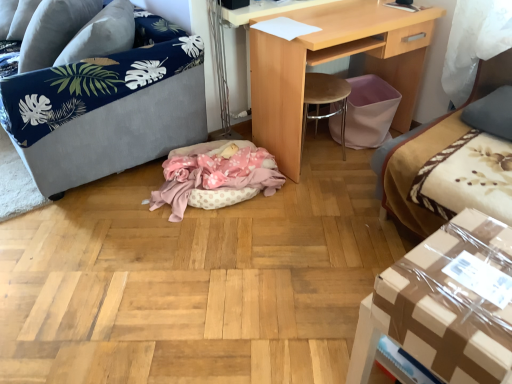
Identify the location of vacant space in front of pink polka dot fabric cat bed at center. The width and height of the screenshot is (512, 384). tap(173, 271).